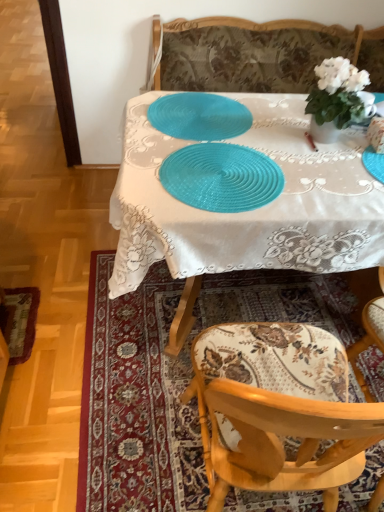
Where is `space that is in front of teal plastic placemat at center, which ranks as the first tableware in top-to-bottom order`? The width and height of the screenshot is (384, 512). space that is in front of teal plastic placemat at center, which ranks as the first tableware in top-to-bottom order is located at coordinates (210, 164).